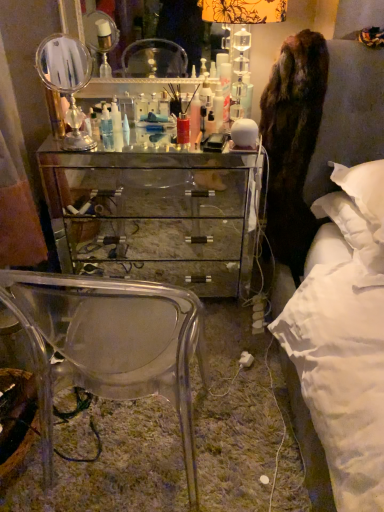
Question: Is white fluffy pillow at right taller or shorter than translucent plastic bottle at center, arranged as the third toiletry when viewed from the right?

Choices:
 (A) tall
 (B) short

Answer: (A)

Question: Considering the relative positions of white fluffy pillow at right and translucent plastic bottle at center, which ranks as the 1th toiletry in left-to-right order, in the image provided, is white fluffy pillow at right to the left or to the right of translucent plastic bottle at center, which ranks as the 1th toiletry in left-to-right order,?

Choices:
 (A) left
 (B) right

Answer: (B)

Question: Based on their relative distances, which object is farther from the brown furry coat at right?

Choices:
 (A) white glossy bottle at center, the third toiletry positioned from the left
 (B) translucent plastic bottle at center, arranged as the third toiletry when viewed from the right
 (C) clear acrylic mirror at center, acting as the 1th mirror starting from the back
 (D) mirrored glass chest of drawers at center
 (E) silver metallic mirror at upper left, the 1th mirror positioned from the bottom

Answer: (C)

Question: Considering the real-world distances, which object is farthest from the mirrored glass chest of drawers at center?

Choices:
 (A) clear glass drawer at center
 (B) silver metallic mirror at upper left, acting as the 1th mirror starting from the front
 (C) translucent plastic bottle at center, which ranks as the 1th toiletry in left-to-right order
 (D) clear plastic bottle at center, the second toiletry from the left
 (E) clear acrylic mirror at center, the second mirror from the bottom

Answer: (E)